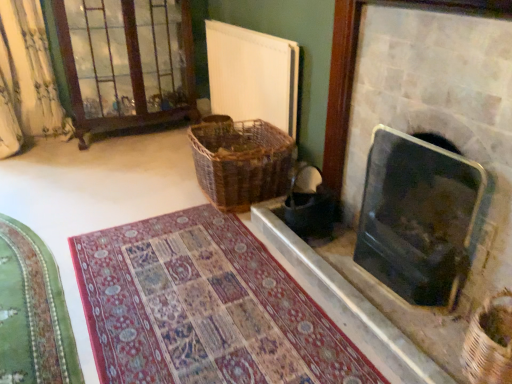
Question: From a real-world perspective, is black glass fireplace at right, marked as the second fireplace in a top-to-bottom arrangement, positioned above or below woven brown basket at lower right, the 1th basket viewed from the front?

Choices:
 (A) above
 (B) below

Answer: (A)

Question: In the image, is black glass fireplace at right, which is the first fireplace from bottom to top, positioned in front of or behind woven brown basket at lower right, the second basket positioned from the left?

Choices:
 (A) front
 (B) behind

Answer: (B)

Question: Estimate the real-world distances between objects in this image. Which object is closer to the green velvet mat at lower left, the 2th mat when ordered from right to left?

Choices:
 (A) black glass fireplace at right, the 1th fireplace when ordered from top to bottom
 (B) dark brown woven laundry basket at center
 (C) patterned carpet at center, acting as the 2th mat starting from the left
 (D) black glass fireplace at right, which is the first fireplace from bottom to top
 (E) white matte radiator at upper center

Answer: (C)

Question: Estimate the real-world distances between objects in this image. Which object is closer to the green velvet mat at lower left, positioned as the first mat in left-to-right order?

Choices:
 (A) woven brown basket at lower right, the 1th basket viewed from the front
 (B) brown wooden glass door at upper left
 (C) black glass fireplace at right, the 1th fireplace when ordered from top to bottom
 (D) black glass fireplace at right, which is the first fireplace from bottom to top
 (E) dark brown woven laundry basket at center

Answer: (E)